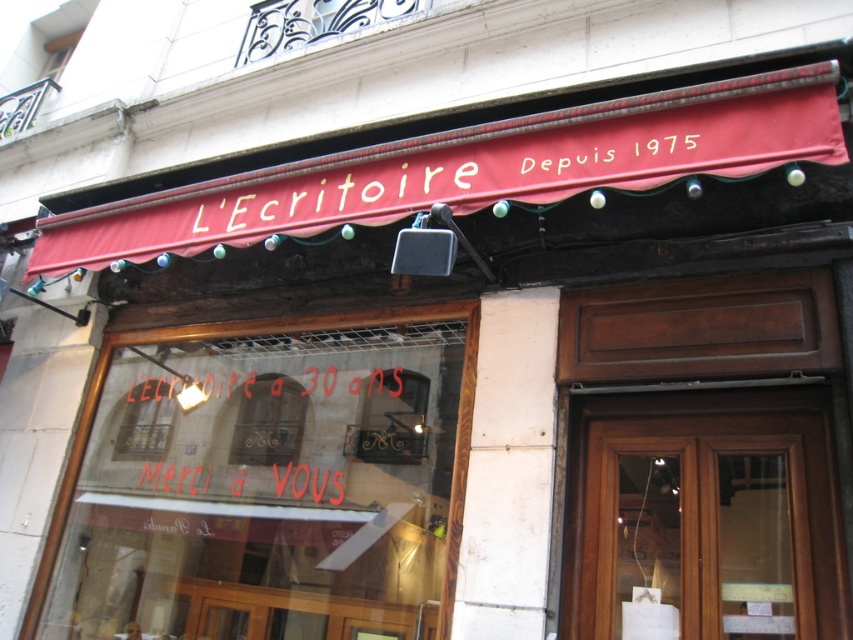
You are a customer standing in front of the store and want to read both the red painted text at center and the gold text sign at upper center. Which one do you need to look up higher to see?

The red painted text at center is much taller than the gold text sign at upper center, so you need to look up higher to see the red painted text at center.

You are standing in front of the shop and want to read both the red painted text at center and the gold text sign at upper center. Which one can you read more clearly?

The red painted text at center can be read more clearly because it is closer to you than the gold text sign at upper center.

You are a customer standing in front of the shop. You see the red painted text at center and the gold text sign at upper center. Which text is larger in size?

The red painted text at center is bigger than the gold text sign at upper center.